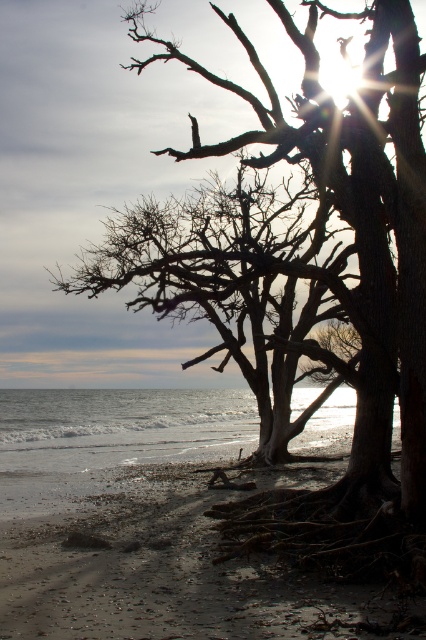
Question: Which object is closer to the camera taking this photo?

Choices:
 (A) silhouette bark tree at center
 (B) clear water at lower left

Answer: (A)

Question: Among these objects, which one is nearest to the camera?

Choices:
 (A) clear water at lower left
 (B) silhouette bark tree at center

Answer: (B)

Question: Which object is the closest to the clear water at lower left?

Choices:
 (A) silhouette bark tree at center
 (B) dull gray sand at lower center

Answer: (A)

Question: Is silhouette bark tree at center smaller than clear water at lower left?

Choices:
 (A) yes
 (B) no

Answer: (B)

Question: Can you confirm if dull gray sand at lower center is smaller than silhouette bark tree at center?

Choices:
 (A) no
 (B) yes

Answer: (B)

Question: Can you confirm if dull gray sand at lower center is positioned above clear water at lower left?

Choices:
 (A) no
 (B) yes

Answer: (B)